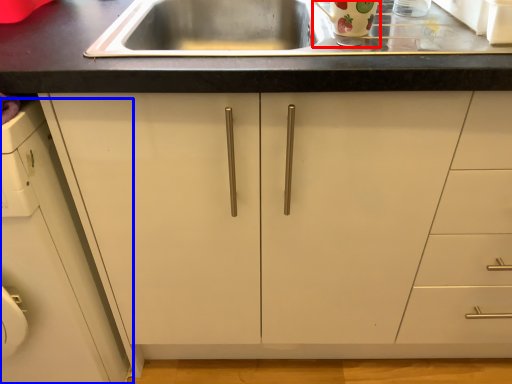
Question: Which object is closer to the camera taking this photo, appliance (highlighted by a red box) or cabinetry (highlighted by a blue box)?

Choices:
 (A) appliance
 (B) cabinetry

Answer: (B)